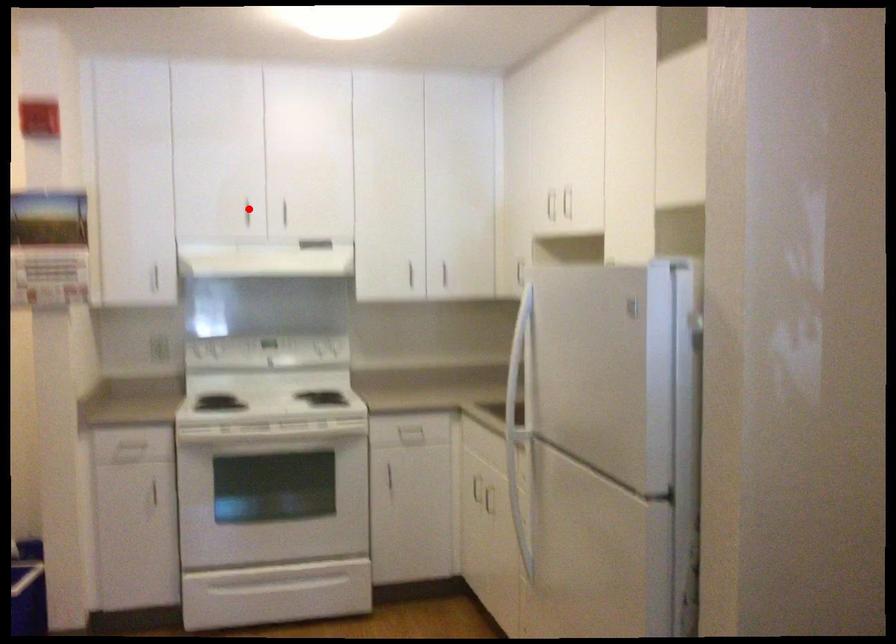
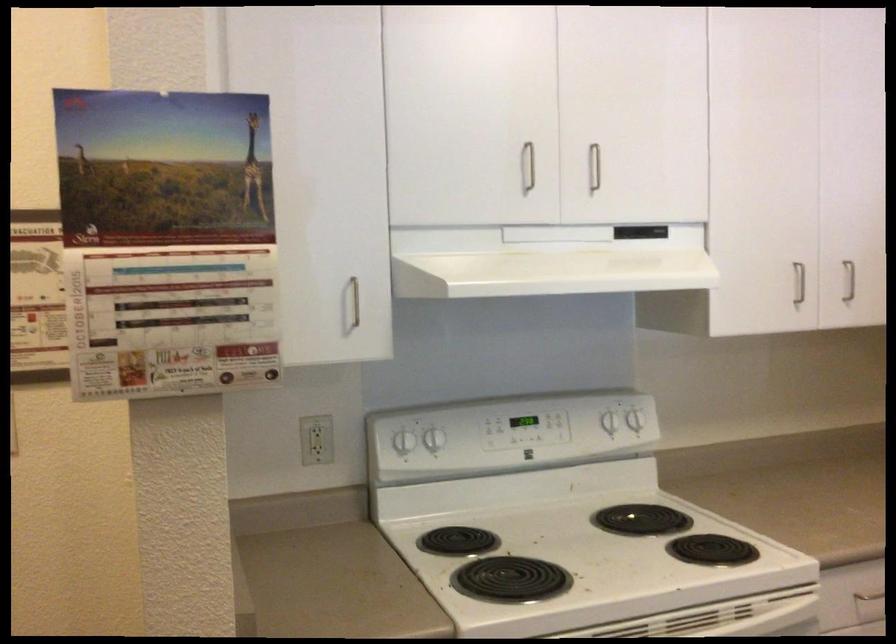
In the second image, find the point that corresponds to the highlighted location in the first image.

(528, 166)